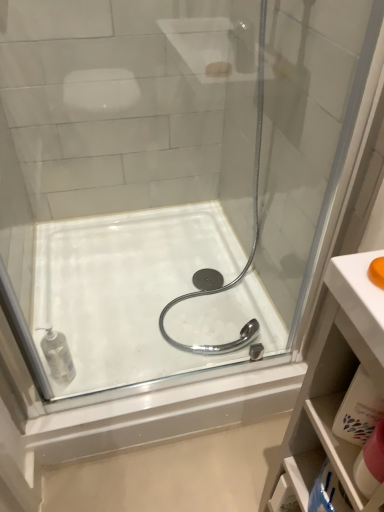
The height and width of the screenshot is (512, 384). Describe the element at coordinates (333, 382) in the screenshot. I see `white plastic cabinet at lower right` at that location.

Measure the distance between pink fabric towel at lower right, placed as the 2th toiletry when sorted from back to front, and camera.

pink fabric towel at lower right, placed as the 2th toiletry when sorted from back to front, and camera are 52.00 centimeters apart.

Find the location of a particular element. This screenshot has width=384, height=512. clear plastic soap dispenser at lower left, which is the second toiletry in front-to-back order is located at coordinates pos(57,355).

Considering the sizes of objects clear plastic soap dispenser at lower left, the 2th toiletry positioned from the right, and white glossy bath at center in the image provided, who is wider, clear plastic soap dispenser at lower left, the 2th toiletry positioned from the right, or white glossy bath at center?

With larger width is white glossy bath at center.

How different are the orientations of clear plastic soap dispenser at lower left, positioned as the 1th toiletry in left-to-right order, and white glossy bath at center in degrees?

There is a 0.472-degree angle between the facing directions of clear plastic soap dispenser at lower left, positioned as the 1th toiletry in left-to-right order, and white glossy bath at center.

Would you say clear plastic soap dispenser at lower left, positioned as the 1th toiletry in left-to-right order, is to the left or to the right of white glossy bath at center in the picture?

clear plastic soap dispenser at lower left, positioned as the 1th toiletry in left-to-right order, is to the left of white glossy bath at center.

Is clear plastic soap dispenser at lower left, the 2th toiletry positioned from the right, positioned with its back to white glossy bath at center?

No, white glossy bath at center is not at the back of clear plastic soap dispenser at lower left, the 2th toiletry positioned from the right.

From the image's perspective, which one is positioned higher, clear plastic soap dispenser at lower left, the 2th toiletry positioned from the right, or white plastic cabinet at lower right?

clear plastic soap dispenser at lower left, the 2th toiletry positioned from the right.

From a real-world perspective, is clear plastic soap dispenser at lower left, marked as the first toiletry in a back-to-front arrangement, located beneath white plastic cabinet at lower right?

Correct, in the physical world, clear plastic soap dispenser at lower left, marked as the first toiletry in a back-to-front arrangement, is lower than white plastic cabinet at lower right.

Would you say clear plastic soap dispenser at lower left, positioned as the 1th toiletry in left-to-right order, is inside or outside white plastic cabinet at lower right?

clear plastic soap dispenser at lower left, positioned as the 1th toiletry in left-to-right order, is not inside white plastic cabinet at lower right, it's outside.

Locate an element on the screen. This screenshot has width=384, height=512. bathroom cabinet that is below the clear plastic soap dispenser at lower left, marked as the first toiletry in a back-to-front arrangement (from the image's perspective) is located at coordinates (333, 382).

Is pink fabric towel at lower right, placed as the second toiletry when sorted from left to right, oriented towards white glossy bath at center?

No, pink fabric towel at lower right, placed as the second toiletry when sorted from left to right, is not facing towards white glossy bath at center.

From a real-world perspective, is pink fabric towel at lower right, placed as the 2th toiletry when sorted from back to front, on white glossy bath at center?

Yes.

In terms of height, does pink fabric towel at lower right, placed as the second toiletry when sorted from left to right, look taller or shorter compared to white glossy bath at center?

Clearly, pink fabric towel at lower right, placed as the second toiletry when sorted from left to right, is taller compared to white glossy bath at center.

From the picture: From the image's perspective, which is below, pink fabric towel at lower right, placed as the 2th toiletry when sorted from back to front, or white glossy bath at center?

A: pink fabric towel at lower right, placed as the 2th toiletry when sorted from back to front, appears lower in the image.

Based on the photo, is white glossy bath at center positioned with its back to pink fabric towel at lower right, which is counted as the first toiletry, starting from the front?

No, white glossy bath at center's orientation is not away from pink fabric towel at lower right, which is counted as the first toiletry, starting from the front.

Is point (84, 322) more distant than point (373, 447)?

Yes, it is.

Between white glossy bath at center and pink fabric towel at lower right, placed as the 1th toiletry when sorted from right to left, which one is positioned in front?

pink fabric towel at lower right, placed as the 1th toiletry when sorted from right to left, is in front.

The width and height of the screenshot is (384, 512). What are the coordinates of `toiletry that appears on the right of white glossy bath at center` in the screenshot? It's located at (370, 462).

In terms of height, does clear plastic soap dispenser at lower left, which is the second toiletry in front-to-back order, look taller or shorter compared to pink fabric towel at lower right, placed as the 2th toiletry when sorted from back to front?

In the image, clear plastic soap dispenser at lower left, which is the second toiletry in front-to-back order, appears to be taller than pink fabric towel at lower right, placed as the 2th toiletry when sorted from back to front.

Is clear plastic soap dispenser at lower left, the 2th toiletry positioned from the right, completely or partially outside of pink fabric towel at lower right, which is counted as the first toiletry, starting from the front?

clear plastic soap dispenser at lower left, the 2th toiletry positioned from the right, lies outside pink fabric towel at lower right, which is counted as the first toiletry, starting from the front,'s area.

Identify the location of bath that appears above the white plastic cabinet at lower right (from the image's perspective). The image size is (384, 512). (127, 291).

Based on the photo, which is closer, (209, 366) or (335, 392)?

Clearly, point (209, 366) is more distant from the camera than point (335, 392).

Relative to white plastic cabinet at lower right, is white glossy bath at center in front or behind?

Clearly, white glossy bath at center is behind white plastic cabinet at lower right.

Can you see white glossy bath at center touching white plastic cabinet at lower right?

No, white glossy bath at center is not touching white plastic cabinet at lower right.

Is white plastic cabinet at lower right facing towards pink fabric towel at lower right, placed as the second toiletry when sorted from left to right?

Yes, white plastic cabinet at lower right is oriented towards pink fabric towel at lower right, placed as the second toiletry when sorted from left to right.

Considering their positions, is white plastic cabinet at lower right located in front of or behind pink fabric towel at lower right, which is counted as the first toiletry, starting from the front?

Clearly, white plastic cabinet at lower right is in front of pink fabric towel at lower right, which is counted as the first toiletry, starting from the front.

Locate an element on the screen. bath located on the right of clear plastic soap dispenser at lower left, the 2th toiletry positioned from the right is located at coordinates 127,291.

Where is `the 2nd toiletry above the white plastic cabinet at lower right (from the image's perspective)`? the 2nd toiletry above the white plastic cabinet at lower right (from the image's perspective) is located at coordinates (57, 355).

When comparing their distances from white plastic cabinet at lower right, does white glossy bath at center or pink fabric towel at lower right, which is counted as the first toiletry, starting from the front, seem further?

The object further to white plastic cabinet at lower right is white glossy bath at center.

Estimate the real-world distances between objects in this image. Which object is closer to clear plastic soap dispenser at lower left, the 2th toiletry positioned from the right, white plastic cabinet at lower right or pink fabric towel at lower right, placed as the 1th toiletry when sorted from right to left?

white plastic cabinet at lower right lies closer to clear plastic soap dispenser at lower left, the 2th toiletry positioned from the right, than the other object.

Estimate the real-world distances between objects in this image. Which object is closer to white plastic cabinet at lower right, clear plastic soap dispenser at lower left, marked as the first toiletry in a back-to-front arrangement, or pink fabric towel at lower right, placed as the second toiletry when sorted from left to right?

pink fabric towel at lower right, placed as the second toiletry when sorted from left to right, is closer to white plastic cabinet at lower right.

From the image, which object appears to be nearer to white plastic cabinet at lower right, white glossy bath at center or clear plastic soap dispenser at lower left, which is the second toiletry in front-to-back order?

Among the two, white glossy bath at center is located nearer to white plastic cabinet at lower right.

Considering their positions, is white plastic cabinet at lower right positioned closer to pink fabric towel at lower right, which is counted as the first toiletry, starting from the front, than clear plastic soap dispenser at lower left, the 2th toiletry positioned from the right?

Among the two, white plastic cabinet at lower right is located nearer to pink fabric towel at lower right, which is counted as the first toiletry, starting from the front.

Which object lies further to the anchor point clear plastic soap dispenser at lower left, which is the second toiletry in front-to-back order, pink fabric towel at lower right, which is counted as the first toiletry, starting from the front, or white glossy bath at center?

Based on the image, pink fabric towel at lower right, which is counted as the first toiletry, starting from the front, appears to be further to clear plastic soap dispenser at lower left, which is the second toiletry in front-to-back order.

Looking at the image, which one is located further to pink fabric towel at lower right, placed as the second toiletry when sorted from left to right, clear plastic soap dispenser at lower left, marked as the first toiletry in a back-to-front arrangement, or white plastic cabinet at lower right?

clear plastic soap dispenser at lower left, marked as the first toiletry in a back-to-front arrangement, is further to pink fabric towel at lower right, placed as the second toiletry when sorted from left to right.

Looking at this image, from the image, which object appears to be farther from white glossy bath at center, pink fabric towel at lower right, placed as the 1th toiletry when sorted from right to left, or white plastic cabinet at lower right?

Based on the image, pink fabric towel at lower right, placed as the 1th toiletry when sorted from right to left, appears to be further to white glossy bath at center.

Locate an element on the screen. This screenshot has width=384, height=512. toiletry between pink fabric towel at lower right, placed as the 2th toiletry when sorted from back to front, and white glossy bath at center from front to back is located at coordinates (57, 355).

Identify the location of toiletry between clear plastic soap dispenser at lower left, marked as the first toiletry in a back-to-front arrangement, and white plastic cabinet at lower right. The width and height of the screenshot is (384, 512). (370, 462).